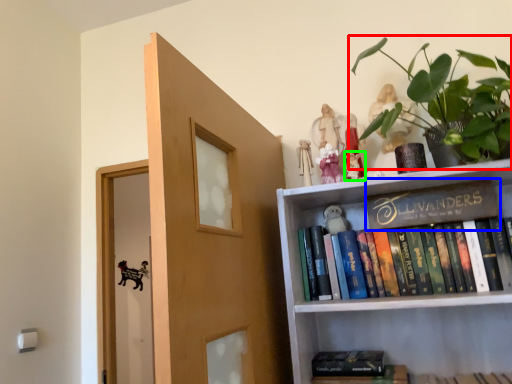
Question: Estimate the real-world distances between objects in this image. Which object is farther from houseplant (highlighted by a red box), book (highlighted by a blue box) or toy (highlighted by a green box)?

Choices:
 (A) book
 (B) toy

Answer: (B)